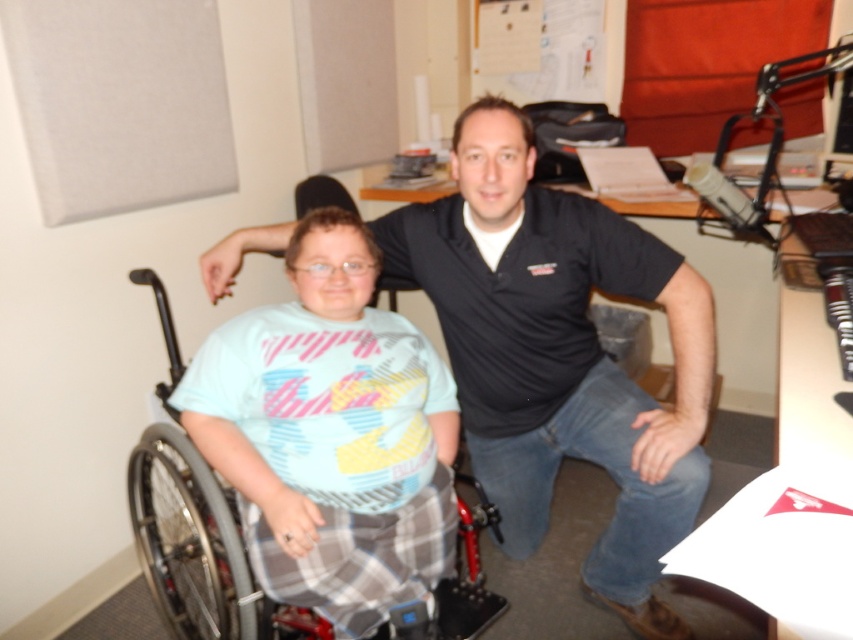
Question: Which object is farther from the camera taking this photo?

Choices:
 (A) black smooth shirt at center
 (B) gray plastic wheelchair at left

Answer: (A)

Question: Does black smooth shirt at center lie behind gray plastic wheelchair at left?

Choices:
 (A) yes
 (B) no

Answer: (A)

Question: Can you confirm if black smooth shirt at center is positioned below gray plastic wheelchair at left?

Choices:
 (A) yes
 (B) no

Answer: (B)

Question: Among these points, which one is farthest from the camera?

Choices:
 (A) (576, 435)
 (B) (148, 572)

Answer: (B)

Question: Does black smooth shirt at center lie behind gray plastic wheelchair at left?

Choices:
 (A) no
 (B) yes

Answer: (B)

Question: Which of the following is the closest to the observer?

Choices:
 (A) gray plastic wheelchair at left
 (B) black smooth shirt at center

Answer: (A)